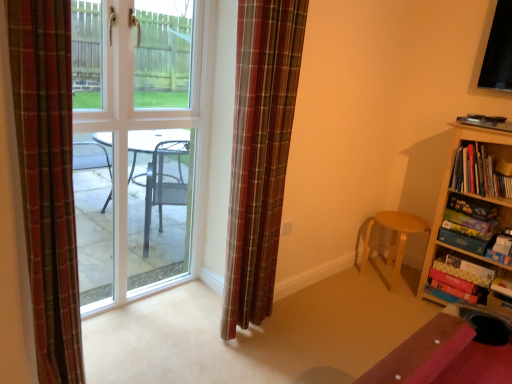
What do you see at coordinates (143, 150) in the screenshot? The image size is (512, 384). I see `clear glass door at center` at bounding box center [143, 150].

Where is `plaid fabric curtain at left, positioned as the 2th curtain in right-to-left order`? This screenshot has height=384, width=512. plaid fabric curtain at left, positioned as the 2th curtain in right-to-left order is located at coordinates (47, 179).

Find the location of a particular element. hardcover book at right is located at coordinates (479, 173).

This screenshot has width=512, height=384. Find the location of `plaid fabric curtain at center, which appears as the 2th curtain when viewed from the left`. plaid fabric curtain at center, which appears as the 2th curtain when viewed from the left is located at coordinates (260, 153).

Considering the sizes of objects hardcover book at right and light brown wooden stool at lower right in the image provided, who is smaller, hardcover book at right or light brown wooden stool at lower right?

With smaller size is hardcover book at right.

Is hardcover book at right taller or shorter than light brown wooden stool at lower right?

Considering their sizes, hardcover book at right has less height than light brown wooden stool at lower right.

Is hardcover book at right inside the boundaries of light brown wooden stool at lower right, or outside?

hardcover book at right exists outside the volume of light brown wooden stool at lower right.

Is light brown wooden stool at lower right next to hardcover book at right?

light brown wooden stool at lower right is not next to hardcover book at right, and they're not touching.

Looking at this image, from the image's perspective, which one is positioned lower, light brown wooden stool at lower right or hardcover book at right?

light brown wooden stool at lower right, from the image's perspective.

What's the angular difference between light brown wooden stool at lower right and hardcover book at right's facing directions?

0.241 degrees separate the facing orientations of light brown wooden stool at lower right and hardcover book at right.

Can hardcover book at right be found inside light brown wooden stool at lower right?

No, light brown wooden stool at lower right does not contain hardcover book at right.

Is the position of wooden bookshelf at right less distant than that of plaid fabric curtain at center, acting as the first curtain starting from the right?

No, it is behind plaid fabric curtain at center, acting as the first curtain starting from the right.

From a real-world perspective, between wooden bookshelf at right and plaid fabric curtain at center, arranged as the second curtain when viewed from the front, who is vertically higher?

In real-world perspective, plaid fabric curtain at center, arranged as the second curtain when viewed from the front, is above.

Is wooden bookshelf at right completely or partially outside of plaid fabric curtain at center, arranged as the 1th curtain when viewed from the back?

Yes, wooden bookshelf at right is located beyond the bounds of plaid fabric curtain at center, arranged as the 1th curtain when viewed from the back.

Is wooden bookshelf at right oriented away from plaid fabric curtain at center, arranged as the 1th curtain when viewed from the back?

No.

Is plaid fabric curtain at left, the 1th curtain viewed from the left, smaller than light brown wooden stool at lower right?

Yes.

Measure the distance between plaid fabric curtain at left, the 1th curtain viewed from the left, and light brown wooden stool at lower right.

plaid fabric curtain at left, the 1th curtain viewed from the left, is 2.09 meters away from light brown wooden stool at lower right.

Do you think plaid fabric curtain at left, which ranks as the 2th curtain in back-to-front order, is within light brown wooden stool at lower right, or outside of it?

plaid fabric curtain at left, which ranks as the 2th curtain in back-to-front order, lies outside light brown wooden stool at lower right.

Considering the positions of objects plaid fabric curtain at left, the 1th curtain viewed from the front, and light brown wooden stool at lower right in the image provided, who is more to the left, plaid fabric curtain at left, the 1th curtain viewed from the front, or light brown wooden stool at lower right?

plaid fabric curtain at left, the 1th curtain viewed from the front.

Is plaid fabric curtain at center, arranged as the second curtain when viewed from the front, inside the boundaries of wooden bookshelf at right, or outside?

plaid fabric curtain at center, arranged as the second curtain when viewed from the front, exists outside the volume of wooden bookshelf at right.

Between plaid fabric curtain at center, arranged as the 1th curtain when viewed from the back, and wooden bookshelf at right, which one has larger width?

wooden bookshelf at right.

In terms of height, does plaid fabric curtain at center, which appears as the 2th curtain when viewed from the left, look taller or shorter compared to wooden bookshelf at right?

Clearly, plaid fabric curtain at center, which appears as the 2th curtain when viewed from the left, is taller compared to wooden bookshelf at right.

Relative to wooden bookshelf at right, is plaid fabric curtain at center, arranged as the 1th curtain when viewed from the back, in front or behind?

plaid fabric curtain at center, arranged as the 1th curtain when viewed from the back, is in front of wooden bookshelf at right.

From a real-world perspective, does clear glass door at center sit lower than plaid fabric curtain at left, positioned as the 2th curtain in right-to-left order?

No, from a real-world perspective, clear glass door at center is not below plaid fabric curtain at left, positioned as the 2th curtain in right-to-left order.

From the image's perspective, is clear glass door at center located above plaid fabric curtain at left, the 1th curtain viewed from the front?

Correct, clear glass door at center appears higher than plaid fabric curtain at left, the 1th curtain viewed from the front, in the image.

Between clear glass door at center and plaid fabric curtain at left, which ranks as the 2th curtain in back-to-front order, which one has larger size?

clear glass door at center is bigger.

Locate an element on the screen. The image size is (512, 384). door above the plaid fabric curtain at left, positioned as the 2th curtain in right-to-left order (from the image's perspective) is located at coordinates (143, 150).

Could you tell me if clear glass door at center is facing plaid fabric curtain at center, arranged as the 1th curtain when viewed from the back?

Yes.

Can you confirm if clear glass door at center is thinner than plaid fabric curtain at center, acting as the first curtain starting from the right?

Yes, clear glass door at center is thinner than plaid fabric curtain at center, acting as the first curtain starting from the right.

Considering their positions, is clear glass door at center located in front of or behind plaid fabric curtain at center, arranged as the second curtain when viewed from the front?

Visually, clear glass door at center is located behind plaid fabric curtain at center, arranged as the second curtain when viewed from the front.

Is point (113, 292) closer to camera compared to point (294, 90)?

No.

This screenshot has width=512, height=384. I want to click on book positioned vertically above the light brown wooden stool at lower right (from a real-world perspective), so click(479, 173).

The image size is (512, 384). In order to click on chair below the hardcover book at right (from the image's perspective) in this screenshot , I will do `click(391, 238)`.

When comparing their distances from plaid fabric curtain at left, the 1th curtain viewed from the front, does wooden bookshelf at right or clear glass door at center seem further?

wooden bookshelf at right is further to plaid fabric curtain at left, the 1th curtain viewed from the front.

When comparing their distances from clear glass door at center, does wooden bookshelf at right or plaid fabric curtain at left, which ranks as the 2th curtain in back-to-front order, seem further?

Among the two, wooden bookshelf at right is located further to clear glass door at center.

When comparing their distances from hardcover book at right, does clear glass door at center or plaid fabric curtain at left, positioned as the 2th curtain in right-to-left order, seem further?

Among the two, plaid fabric curtain at left, positioned as the 2th curtain in right-to-left order, is located further to hardcover book at right.

Looking at the image, which one is located further to hardcover book at right, light brown wooden stool at lower right or plaid fabric curtain at left, the 1th curtain viewed from the left?

Among the two, plaid fabric curtain at left, the 1th curtain viewed from the left, is located further to hardcover book at right.

When comparing their distances from plaid fabric curtain at left, which ranks as the 2th curtain in back-to-front order, does hardcover book at right or light brown wooden stool at lower right seem further?

hardcover book at right is further to plaid fabric curtain at left, which ranks as the 2th curtain in back-to-front order.

Which object lies nearer to the anchor point wooden bookshelf at right, clear glass door at center or hardcover book at right?

hardcover book at right.

Estimate the real-world distances between objects in this image. Which object is closer to clear glass door at center, plaid fabric curtain at left, which ranks as the 2th curtain in back-to-front order, or light brown wooden stool at lower right?

The object closer to clear glass door at center is plaid fabric curtain at left, which ranks as the 2th curtain in back-to-front order.

Looking at the image, which one is located closer to hardcover book at right, plaid fabric curtain at left, the 1th curtain viewed from the front, or wooden bookshelf at right?

wooden bookshelf at right lies closer to hardcover book at right than the other object.

Find the location of a particular element. The height and width of the screenshot is (384, 512). door situated between plaid fabric curtain at left, which ranks as the 2th curtain in back-to-front order, and hardcover book at right from left to right is located at coordinates (143, 150).

Locate an element on the screen. Image resolution: width=512 pixels, height=384 pixels. chair located between clear glass door at center and hardcover book at right in the left-right direction is located at coordinates (391, 238).

Find the location of a particular element. This screenshot has height=384, width=512. book between wooden bookshelf at right and light brown wooden stool at lower right along the z-axis is located at coordinates (479, 173).

You are a GUI agent. You are given a task and a screenshot of the screen. Output one action in this format:
    pyautogui.click(x=<x>, y=<y>)
    Task: Click on the book between clear glass door at center and wooden bookshelf at right in the horizontal direction
    
    Given the screenshot: What is the action you would take?
    pyautogui.click(x=479, y=173)